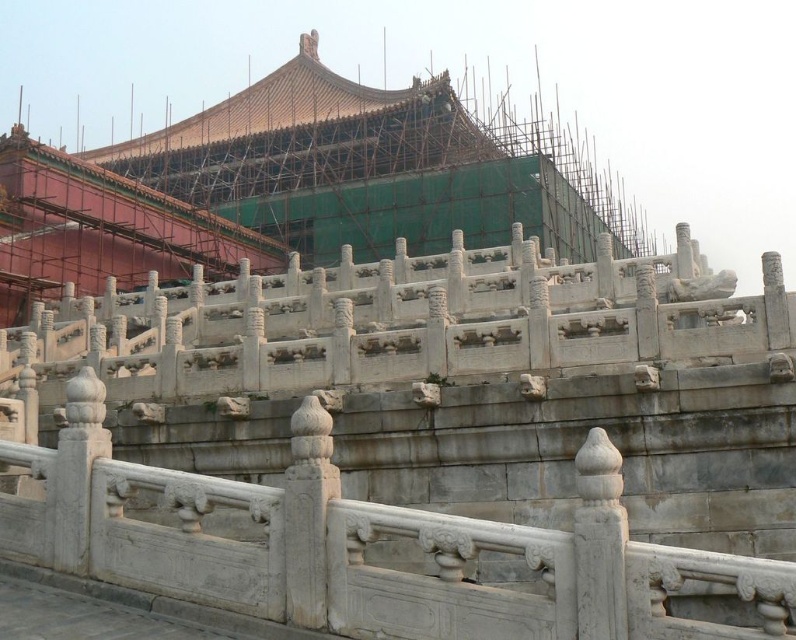
Question: Which point appears farthest from the camera in this image?

Choices:
 (A) 61,346
 (B) 209,109

Answer: (B)

Question: Can you confirm if white stone railing at center is thinner than white stone palace at center?

Choices:
 (A) yes
 (B) no

Answer: (A)

Question: In this image, where is white stone railing at center located relative to white stone palace at center?

Choices:
 (A) left
 (B) right

Answer: (B)

Question: Which point is farther to the camera?

Choices:
 (A) white stone palace at center
 (B) white stone railing at center

Answer: (A)

Question: Is white stone railing at center above white stone palace at center?

Choices:
 (A) yes
 (B) no

Answer: (B)

Question: Among these points, which one is nearest to the camera?

Choices:
 (A) (233, 337)
 (B) (217, 131)

Answer: (A)